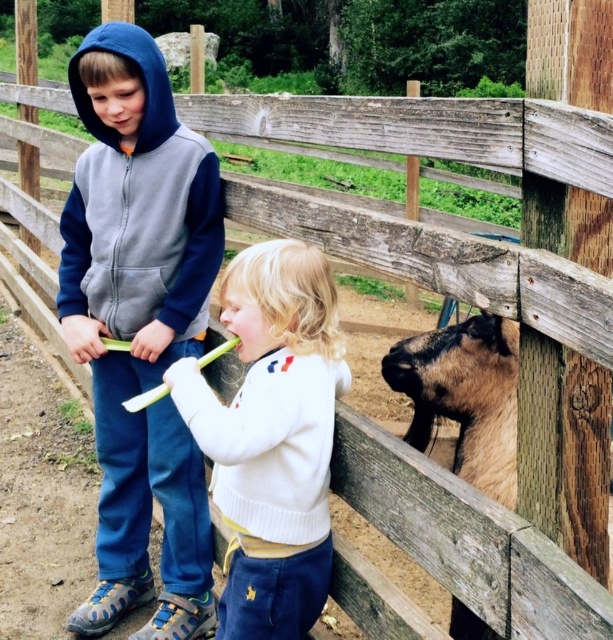
Question: Among these points, which one is farthest from the camera?

Choices:
 (A) pos(72,618)
 (B) pos(287,557)
 (C) pos(481,339)

Answer: (A)

Question: Can you confirm if white soft sweater at center is wider than brown fuzzy goat at right?

Choices:
 (A) yes
 (B) no

Answer: (A)

Question: Which of these objects is positioned closest to the navy blue fleece hoodie at center?

Choices:
 (A) brown fuzzy goat at right
 (B) white soft sweater at center

Answer: (B)

Question: Which point is farther to the camera?

Choices:
 (A) navy blue fleece hoodie at center
 (B) brown fuzzy goat at right
 (C) white soft sweater at center

Answer: (B)

Question: Is white soft sweater at center below brown fuzzy goat at right?

Choices:
 (A) yes
 (B) no

Answer: (A)

Question: Observing the image, what is the correct spatial positioning of white soft sweater at center in reference to brown fuzzy goat at right?

Choices:
 (A) right
 (B) left

Answer: (B)